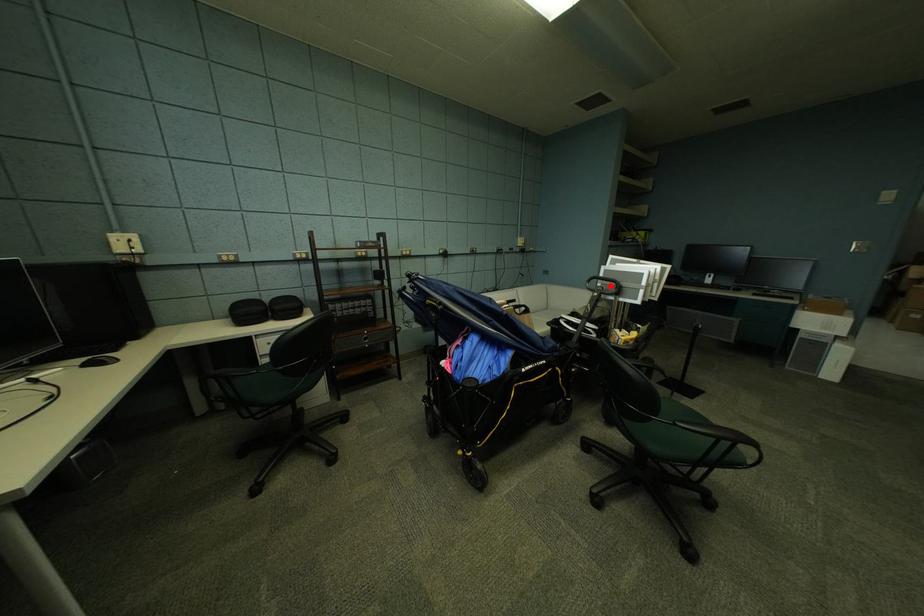
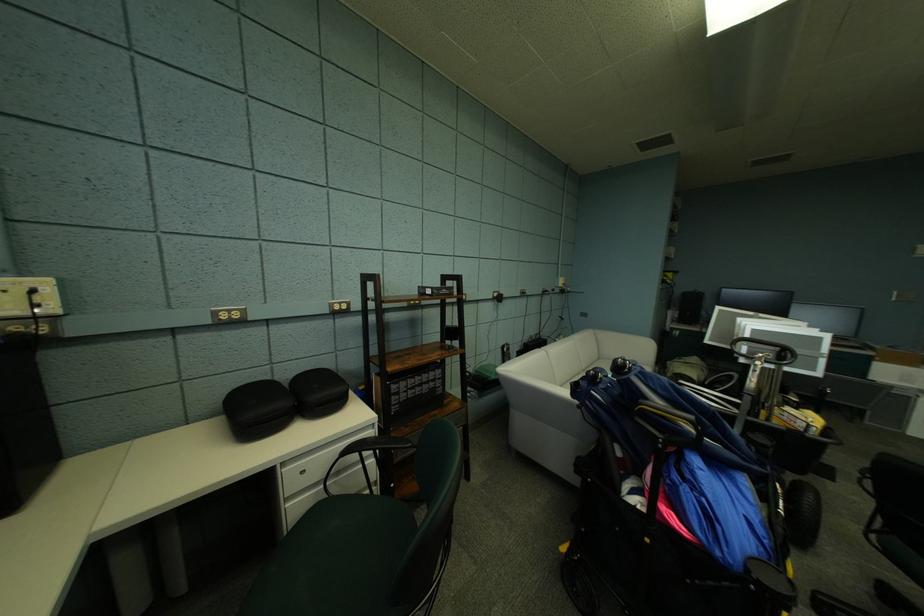
In the second image, find the point that corresponds to the highlighted location in the first image.

(758, 349)